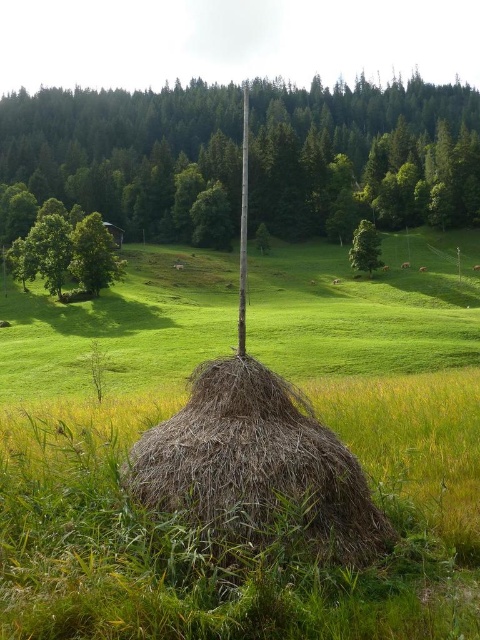
You are a farmer who wants to place a scarecrow on the tallest object in the scene. Which object should you choose between the dry straw bale at center and the green leafy tree at left?

The green leafy tree at left is taller than the dry straw bale at center, so you should place the scarecrow on the green leafy tree at left.

You are a farmer who wants to place a new scarecrow between the dry straw bale at center and the green leafy tree at left. Based on their widths, which object should the scarecrow be closer to?

The dry straw bale at center is thinner than the green leafy tree at left, so the scarecrow should be placed closer to the green leafy tree at left to balance their widths.

You are standing in the countryside and see the brown rough pole at center and the dry straw bale at center. Which object is positioned to the right side?

The brown rough pole at center is to the right of the dry straw bale at center.